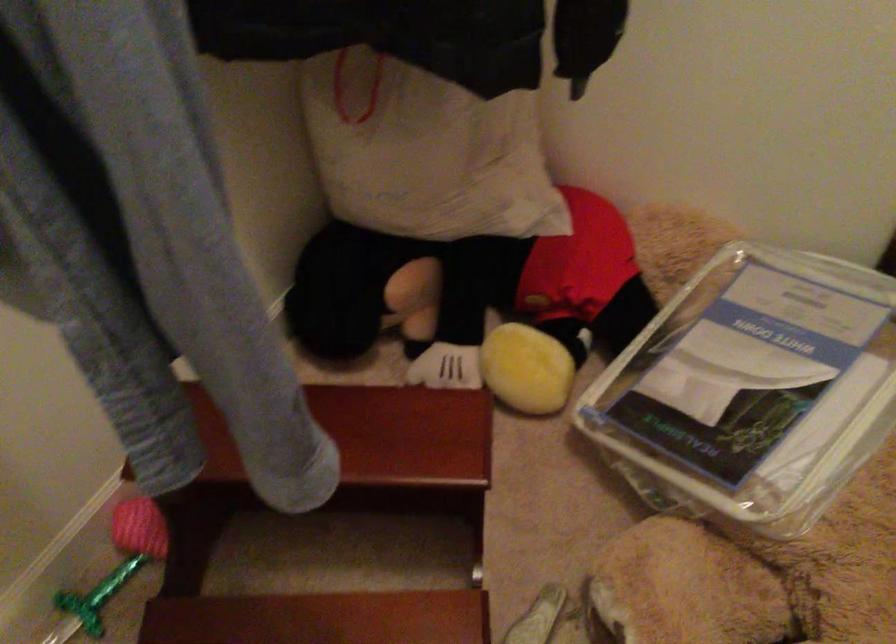
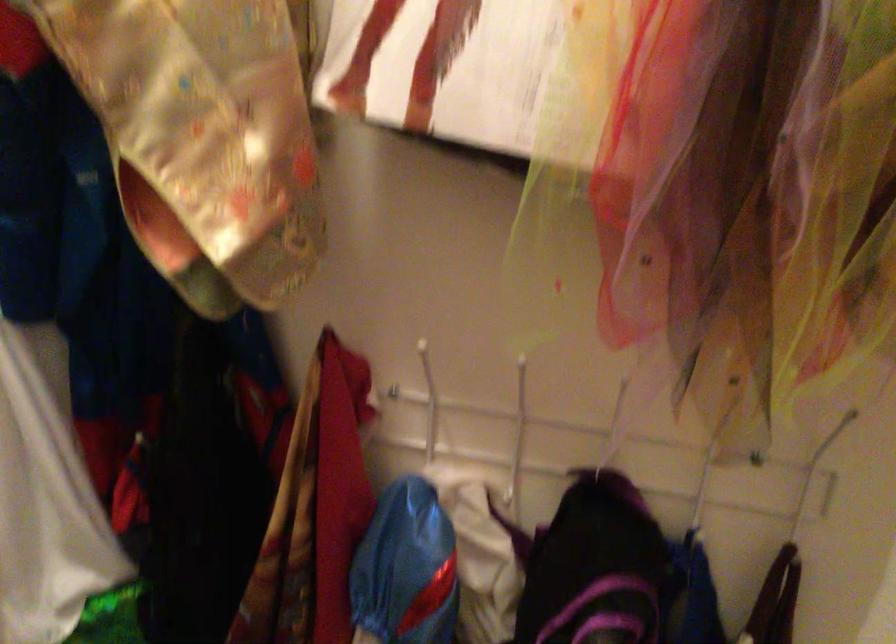
Consider the image. The images are taken continuously from a first-person perspective. In which direction is your viewpoint rotating?

The rotation direction of the camera is right-down.